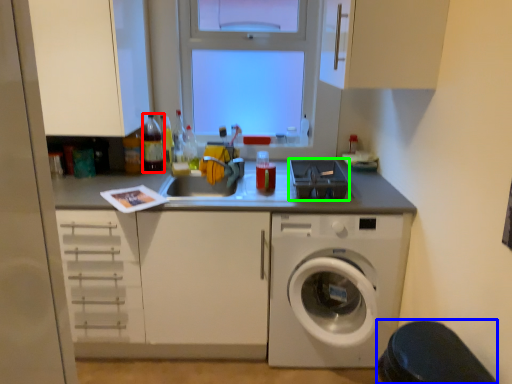
Question: Considering the real-world distances, which object is farthest from bottle (highlighted by a red box)? step stool (highlighted by a blue box) or appliance (highlighted by a green box)?

Choices:
 (A) step stool
 (B) appliance

Answer: (A)